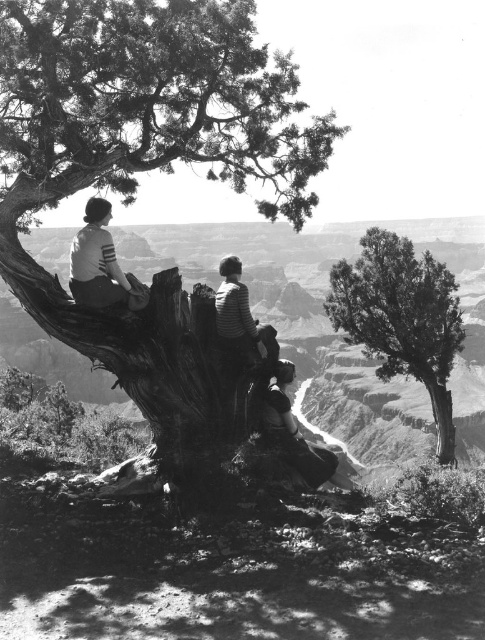
Question: Which object is closer to the camera taking this photo?

Choices:
 (A) smooth bark tree at right
 (B) striped jersey at upper left

Answer: (B)

Question: Is the position of smooth bark tree at right more distant than that of striped jersey at upper left?

Choices:
 (A) no
 (B) yes

Answer: (B)

Question: Does smooth bark tree at right have a lesser width compared to striped jersey at upper left?

Choices:
 (A) yes
 (B) no

Answer: (B)

Question: Which point is farther to the camera?

Choices:
 (A) (120, 268)
 (B) (415, 307)
 (C) (276, 70)

Answer: (A)

Question: Does rough bark tree trunk at left appear over striped jersey at upper left?

Choices:
 (A) yes
 (B) no

Answer: (B)

Question: Which is nearer to the smooth bark tree at right?

Choices:
 (A) striped jersey at upper left
 (B) rough bark tree trunk at left

Answer: (B)